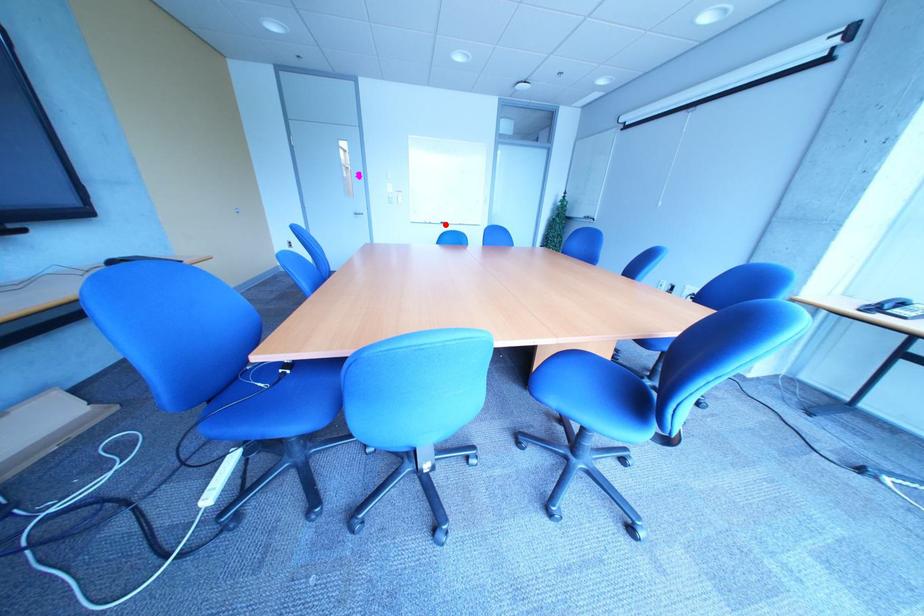
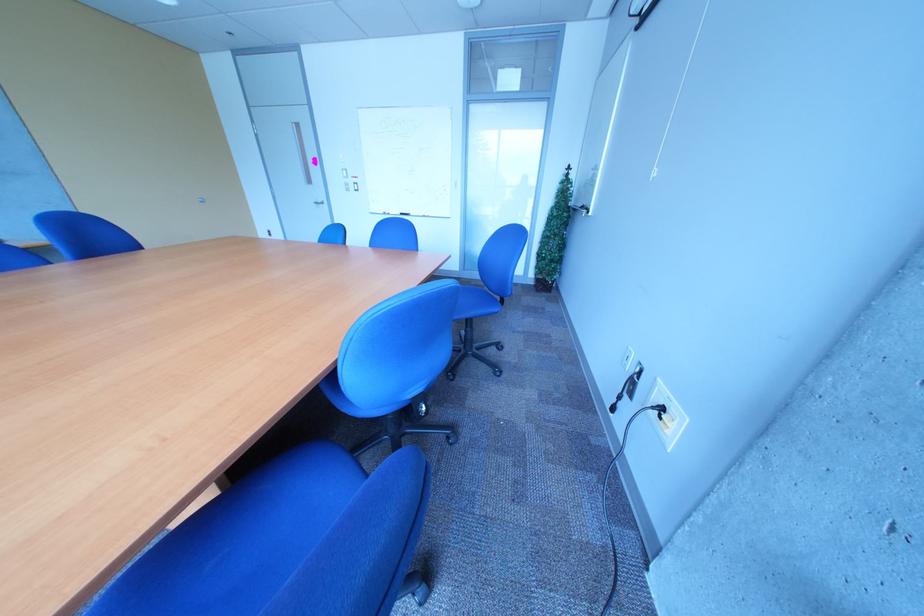
Question: I am providing you with two images of the same scene from different viewpoints. A red point is shown in image1. For the corresponding object point in image2, is it positioned nearer or farther from the camera?

Choices:
 (A) Nearer
 (B) Farther

Answer: (B)